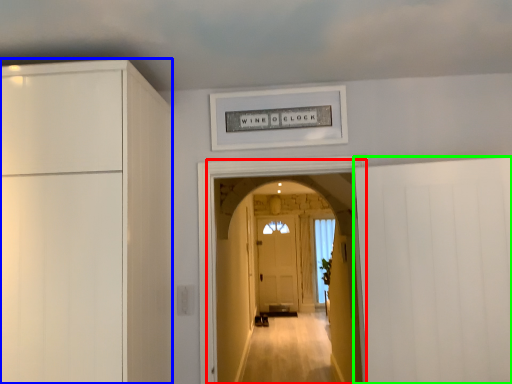
Question: Considering the real-world distances, which object is closest to corridor (highlighted by a red box)? cabinetry (highlighted by a blue box) or door (highlighted by a green box).

Choices:
 (A) cabinetry
 (B) door

Answer: (B)